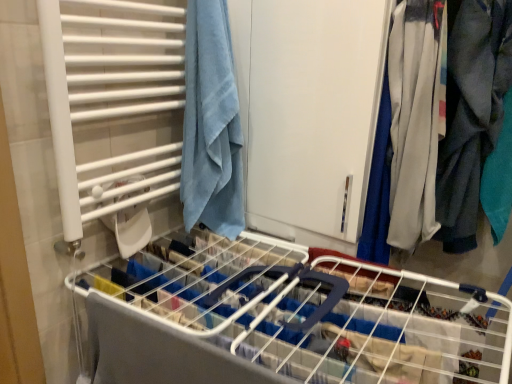
Question: Is gray cotton pants at right aimed at white matte cabinet at center?

Choices:
 (A) yes
 (B) no

Answer: (B)

Question: From the image's perspective, is gray cotton pants at right on top of white matte cabinet at center?

Choices:
 (A) yes
 (B) no

Answer: (B)

Question: Considering the relative sizes of gray cotton pants at right and white matte cabinet at center in the image provided, is gray cotton pants at right taller than white matte cabinet at center?

Choices:
 (A) no
 (B) yes

Answer: (A)

Question: Can you confirm if gray cotton pants at right is thinner than white matte cabinet at center?

Choices:
 (A) yes
 (B) no

Answer: (A)

Question: Are gray cotton pants at right and white matte cabinet at center making contact?

Choices:
 (A) no
 (B) yes

Answer: (A)

Question: Is gray cotton pants at right far away from white matte cabinet at center?

Choices:
 (A) no
 (B) yes

Answer: (A)

Question: Is blue cotton towel at upper left shorter than gray cotton pants at right?

Choices:
 (A) no
 (B) yes

Answer: (B)

Question: Does blue cotton towel at upper left come in front of gray cotton pants at right?

Choices:
 (A) yes
 (B) no

Answer: (B)

Question: Can you confirm if blue cotton towel at upper left is positioned to the left of gray cotton pants at right?

Choices:
 (A) no
 (B) yes

Answer: (B)

Question: Does blue cotton towel at upper left have a greater width compared to gray cotton pants at right?

Choices:
 (A) no
 (B) yes

Answer: (B)

Question: From the image's perspective, would you say blue cotton towel at upper left is positioned over gray cotton pants at right?

Choices:
 (A) yes
 (B) no

Answer: (A)

Question: Considering the relative positions of blue cotton towel at upper left and gray cotton pants at right in the image provided, is blue cotton towel at upper left behind gray cotton pants at right?

Choices:
 (A) yes
 (B) no

Answer: (A)

Question: Can you confirm if white plastic bed frame at center is positioned to the left of white matte cabinet at center?

Choices:
 (A) yes
 (B) no

Answer: (A)